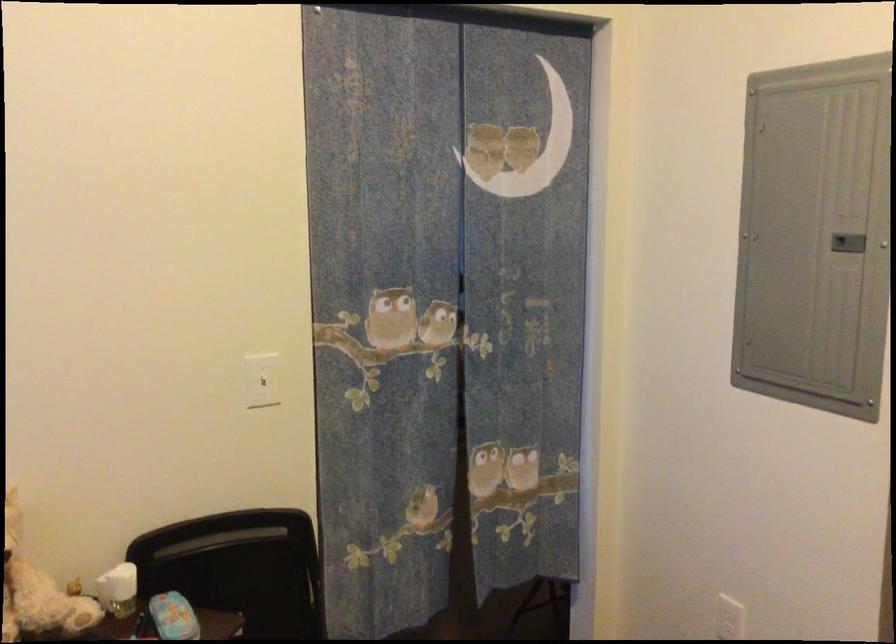
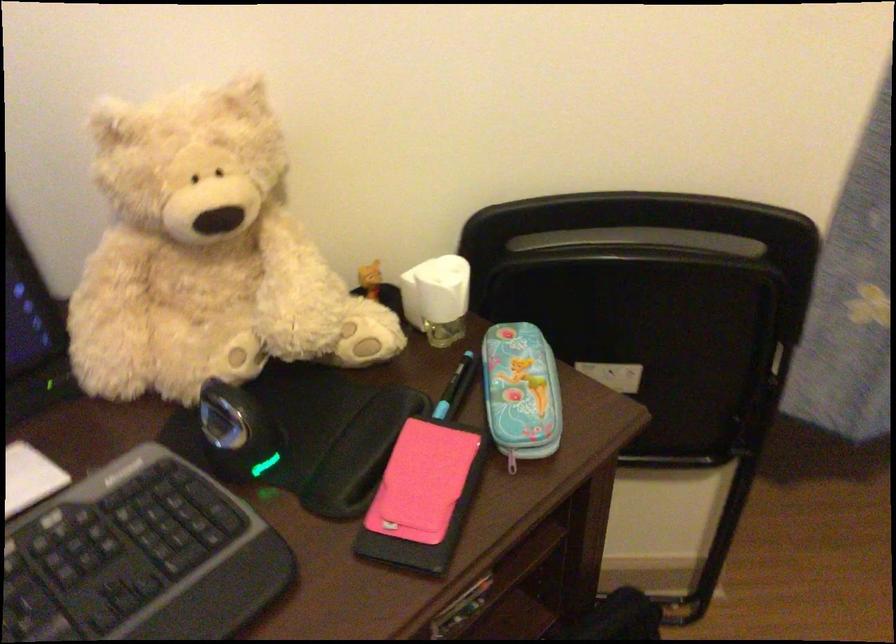
The point at (x=229, y=538) is marked in the first image. Where is the corresponding point in the second image?

(642, 240)